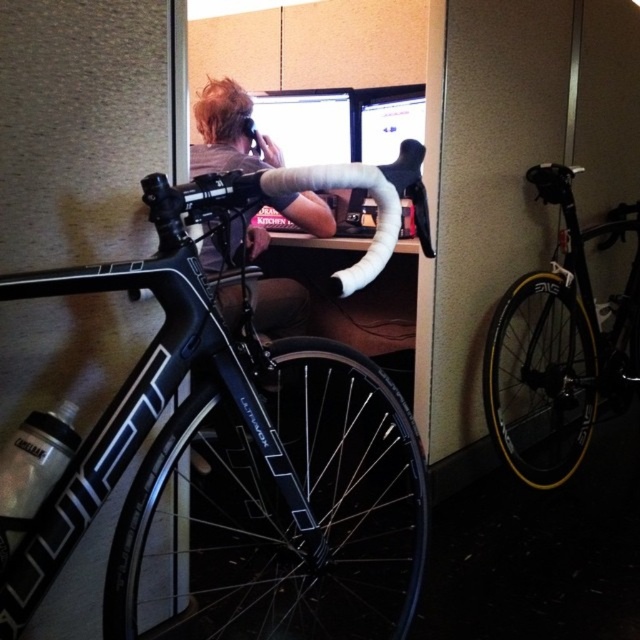
You are an office worker who wants to move from your desk to the door located behind the black matte road bike at right. Can you walk around the black matte road bike at center to reach the door?

The black matte road bike at center is in front of the black matte road bike at right, so you can walk around the black matte road bike at center to reach the door behind the black matte road bike at right.

You are an office worker who wants to move the black matte road bike at right closer to the blonde hair at upper center. Considering their sizes, do you think the bike will fit in the space where the blonde hair is located?

The black matte road bike at right is larger in size than the blonde hair at upper center, so it may not fit in the space where the blonde hair is located.